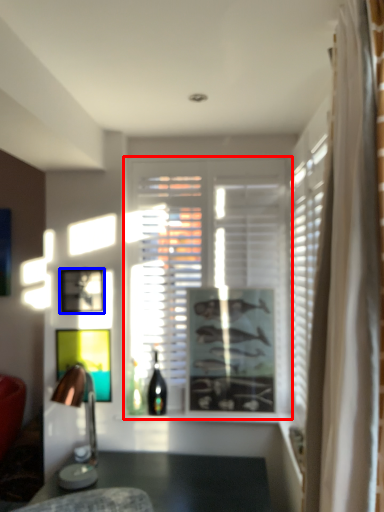
Question: Which point is further to the camera, window (highlighted by a red box) or picture frame (highlighted by a blue box)?

Choices:
 (A) window
 (B) picture frame

Answer: (A)